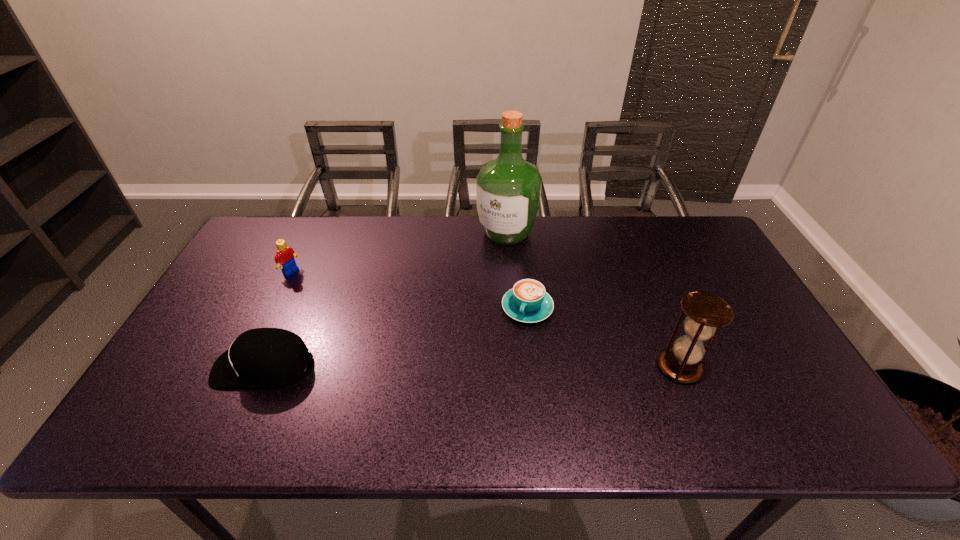
Where is `unoccupied position between the cap and the third farthest object`? unoccupied position between the cap and the third farthest object is located at coordinates (396, 337).

Locate an element on the screen. free space between the liquor and the Lego is located at coordinates (398, 252).

Image resolution: width=960 pixels, height=540 pixels. What are the coordinates of `vacant area between the second tallest object and the Lego` in the screenshot? It's located at (485, 319).

The image size is (960, 540). Find the location of `unoccupied area between the third shortest object and the hourglass`. unoccupied area between the third shortest object and the hourglass is located at coordinates [485, 319].

Locate an element on the screen. This screenshot has width=960, height=540. object that ranks as the closest to the third farthest object is located at coordinates (508, 189).

The width and height of the screenshot is (960, 540). What are the coordinates of `object that is the fourth closest to the rightmost object` in the screenshot? It's located at (285, 255).

I want to click on free point that satisfies the following two spatial constraints: 1. on the front side of the third shortest object; 2. on the front-facing side of the fourth tallest object, so click(245, 366).

The height and width of the screenshot is (540, 960). What are the coordinates of `free space in the image that satisfies the following two spatial constraints: 1. on the front side of the fourth tallest object; 2. on the front-facing side of the fourth nearest object` in the screenshot? It's located at (245, 366).

Find the location of a particular element. Image resolution: width=960 pixels, height=540 pixels. free location that satisfies the following two spatial constraints: 1. on the front side of the fourth shortest object; 2. on the left side of the shortest object is located at coordinates (534, 367).